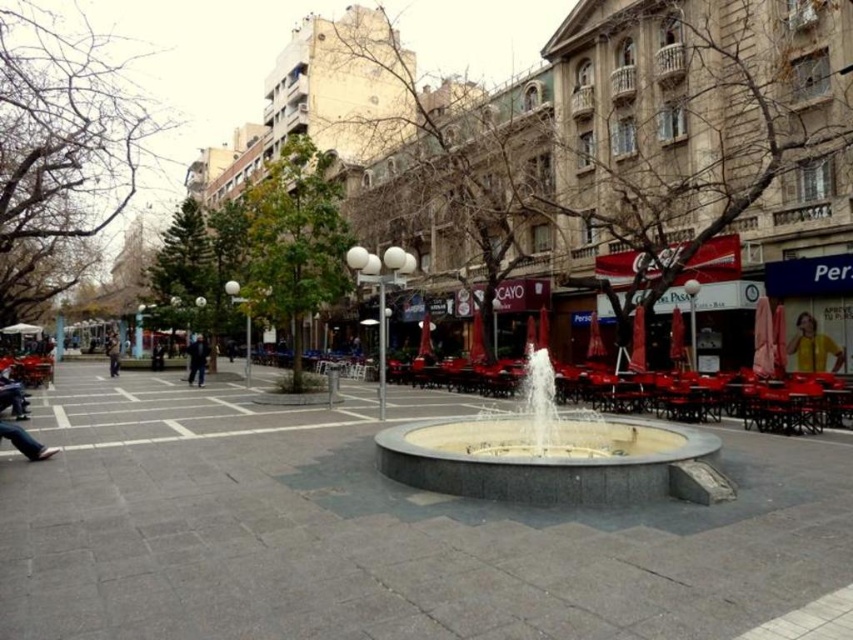
You are standing in the public square and want to locate the white marble fountain at center. From your current position near the dark blue jeans at left, in which direction should you move to reach it?

The white marble fountain at center is to the right of the dark blue jeans at left, so you should move to your right to reach it.

You are standing in the public square and want to take a photo of the smooth concrete fountain at center. To ensure the yellow fabric person at lower right doesn not block the view, where should you position yourself?

You should position yourself behind the yellow fabric person at lower right because the smooth concrete fountain at center is shorter than the yellow fabric person at lower right, so standing behind them will allow the fountain to be visible without obstruction.